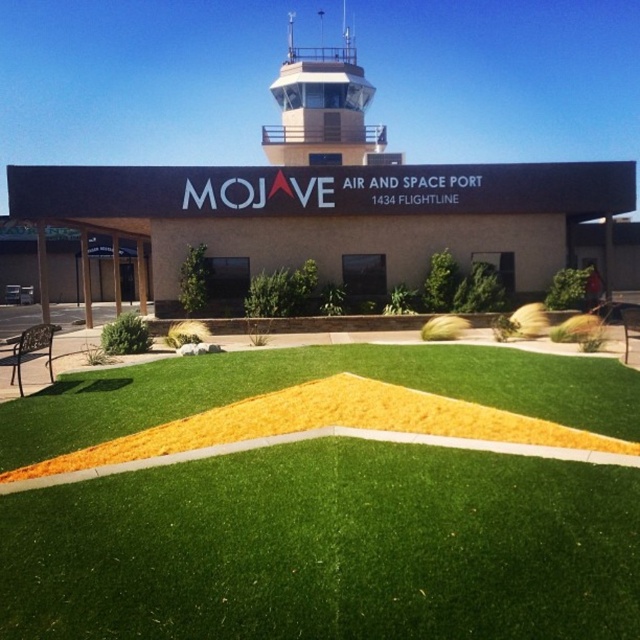
You are standing at the entrance of the Mojave Air and Space Port and see two points marked on the ground in front of you. The first point is at coordinates point (156,522) and the second is at point (301,150). Which point is closer to your current position?

Point (156,522) is closer to the camera than point (301,150), so the first point is closer to your current position.

You are a drone operator preparing to land a drone on the green artificial grass at center. However, you notice the matte gray control tower at upper center. Considering their heights, will the drone be able to land safely without hitting the control tower?

The green artificial grass at center is shorter than the matte gray control tower at upper center. Since the control tower is taller, the drone should be able to land safely on the grass without hitting the tower as long as it maintains a proper altitude and trajectory.

You are a drone operator preparing to land a drone at Mojave Air and Space Port. You need to ensure the drone avoids obstacles. Based on the scene, which object is positioned to the right of the other between the green artificial grass at center and the matte gray control tower at upper center?

The green artificial grass at center is to the right of the matte gray control tower at upper center, so the grass is positioned to the right of the control tower.